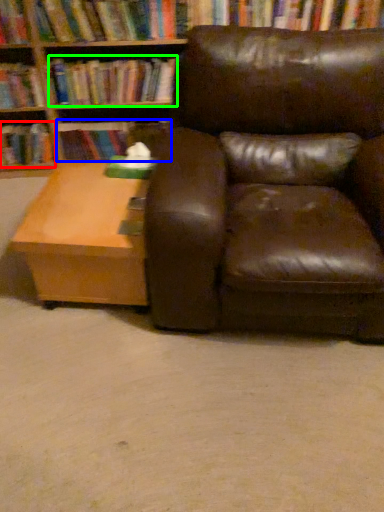
Question: Which object is the farthest from book (highlighted by a red box)? Choose among these: book (highlighted by a blue box) or book (highlighted by a green box).

Choices:
 (A) book
 (B) book

Answer: (B)